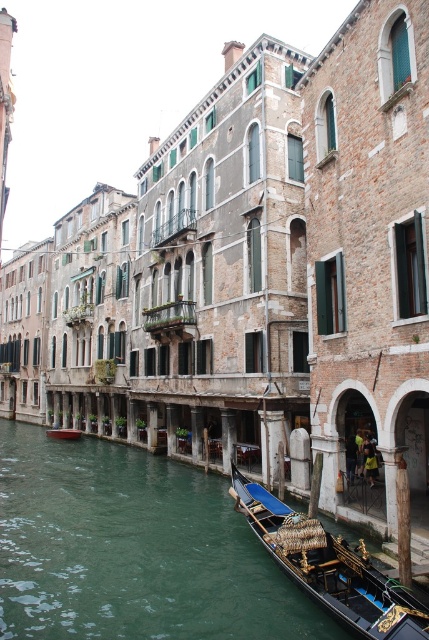
You are standing on a bridge overlooking the canal and want to locate the black polished wood gondola at lower right. According to the coordinate system where the bottom left corner is the origin, can you determine its position?

The black polished wood gondola at lower right is located at coordinate point [329,568].

You are a tourist standing on the bridge overlooking the canal. You see the black polished wood gondola at lower right and the wooden gondola at center. Which gondola has a higher deck compared to the other?

The black polished wood gondola at lower right is much taller than the wooden gondola at center, so the black polished wood gondola at lower right has a higher deck.

You are a tourist standing on the bridge overlooking the canal. You see the black polished wood gondola at lower right and the wooden gondola at center. Which gondola would you estimate is bigger in size?

The black polished wood gondola at lower right is larger in size than the wooden gondola at center.